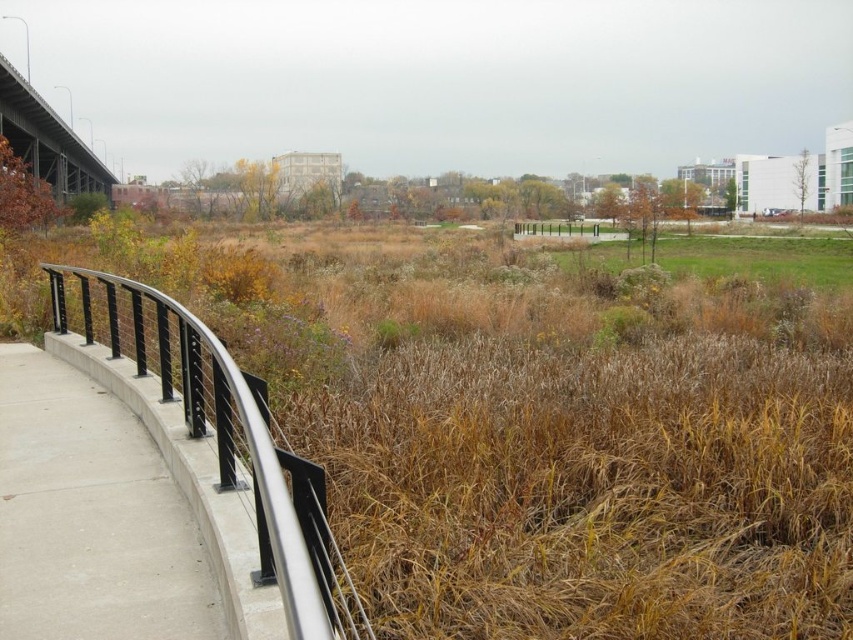
Can you confirm if green grass at center is thinner than concrete bridge at upper left?

Correct, green grass at center's width is less than concrete bridge at upper left's.

Measure the distance between point (618, 260) and camera.

34.19 meters

The height and width of the screenshot is (640, 853). Find the location of `green grass at center`. green grass at center is located at coordinates (723, 257).

Is brown dry grass at center taller than concrete bridge at upper left?

No, brown dry grass at center is not taller than concrete bridge at upper left.

Between point (410, 529) and point (80, 177), which one is positioned behind?

The point (80, 177) is more distant.

Where is `brown dry grass at center`? The width and height of the screenshot is (853, 640). brown dry grass at center is located at coordinates (546, 422).

Can you confirm if brown dry grass at center is shorter than concrete at left?

No, brown dry grass at center is not shorter than concrete at left.

Which is behind, point (796, 320) or point (102, 538)?

The point (796, 320) is behind.

Describe the element at coordinates (546, 422) in the screenshot. The image size is (853, 640). I see `brown dry grass at center` at that location.

Identify the location of brown dry grass at center. The image size is (853, 640). (546, 422).